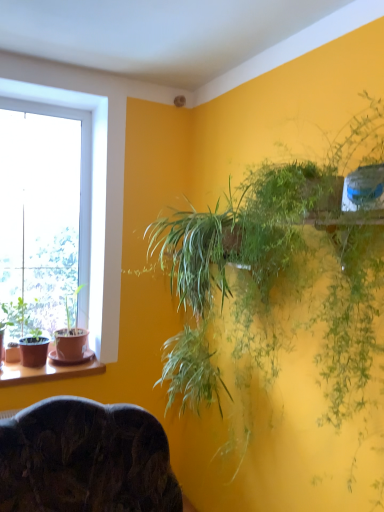
Question: Is dark wood chair at lower center completely or partially inside transparent glass window at left?

Choices:
 (A) no
 (B) yes

Answer: (A)

Question: From a real-world perspective, does transparent glass window at left sit lower than dark wood chair at lower center?

Choices:
 (A) yes
 (B) no

Answer: (B)

Question: Can you confirm if transparent glass window at left is smaller than dark wood chair at lower center?

Choices:
 (A) yes
 (B) no

Answer: (A)

Question: Is transparent glass window at left positioned beyond the bounds of dark wood chair at lower center?

Choices:
 (A) yes
 (B) no

Answer: (A)

Question: From the image's perspective, does transparent glass window at left appear lower than dark wood chair at lower center?

Choices:
 (A) no
 (B) yes

Answer: (A)

Question: From a real-world perspective, is transparent glass window at left physically above dark wood chair at lower center?

Choices:
 (A) yes
 (B) no

Answer: (A)

Question: Does green leafy plant at upper right, the 1th houseplant viewed from the right, have a greater height compared to matte brown pot at left, arranged as the second houseplant when viewed from the left?

Choices:
 (A) no
 (B) yes

Answer: (B)

Question: Is matte brown pot at left, arranged as the second houseplant when viewed from the left, surrounded by green leafy plant at upper right, the 1th houseplant viewed from the right?

Choices:
 (A) yes
 (B) no

Answer: (B)

Question: Is green leafy plant at upper right, the 1th houseplant positioned from the front, outside matte brown pot at left, arranged as the second houseplant when viewed from the left?

Choices:
 (A) yes
 (B) no

Answer: (A)

Question: Is the position of green leafy plant at upper right, which ranks as the 3th houseplant in back-to-front order, more distant than that of matte brown pot at left, which ranks as the 3th houseplant in front-to-back order?

Choices:
 (A) no
 (B) yes

Answer: (A)

Question: From a real-world perspective, is green leafy plant at upper right, the 1th houseplant positioned from the front, located higher than matte brown pot at left, which appears as the second houseplant when viewed from the right?

Choices:
 (A) no
 (B) yes

Answer: (B)

Question: Considering the relative positions of green leafy plant at upper right, the 1th houseplant viewed from the right, and matte brown pot at left, which appears as the second houseplant when viewed from the right, in the image provided, is green leafy plant at upper right, the 1th houseplant viewed from the right, in front of matte brown pot at left, which appears as the second houseplant when viewed from the right,?

Choices:
 (A) no
 (B) yes

Answer: (B)

Question: From the image's perspective, is green matte pot at left, which appears as the 3th houseplant when viewed from the right, under matte brown pot at left, which appears as the second houseplant when viewed from the right?

Choices:
 (A) yes
 (B) no

Answer: (A)